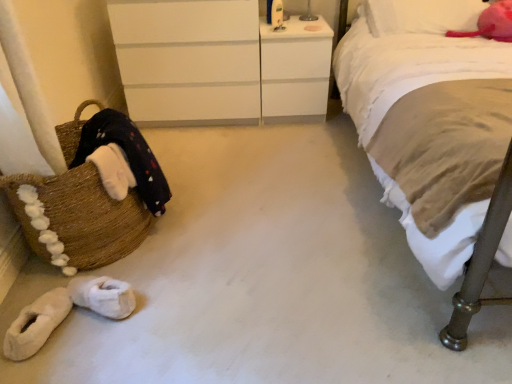
Question: In terms of width, does white glossy vanity at upper center look wider or thinner when compared to velvety pink pillow at upper right?

Choices:
 (A) wide
 (B) thin

Answer: (A)

Question: Based on their positions, is white glossy vanity at upper center located to the left or right of velvety pink pillow at upper right?

Choices:
 (A) left
 (B) right

Answer: (A)

Question: Which object is the closest to the white glossy vanity at upper center?

Choices:
 (A) white fluffy slippers at lower left, the first footwear positioned from the right
 (B) brown woven basket at left
 (C) velvety pink pillow at upper right
 (D) beige cotton bed at right
 (E) white matte chest of drawers at upper center

Answer: (E)

Question: Which object is the farthest from the white glossy vanity at upper center?

Choices:
 (A) white fluffy slippers at lower left, placed as the 2th footwear when sorted from left to right
 (B) beige cotton bed at right
 (C) white matte chest of drawers at upper center
 (D) velvety pink pillow at upper right
 (E) brown woven basket at left

Answer: (A)